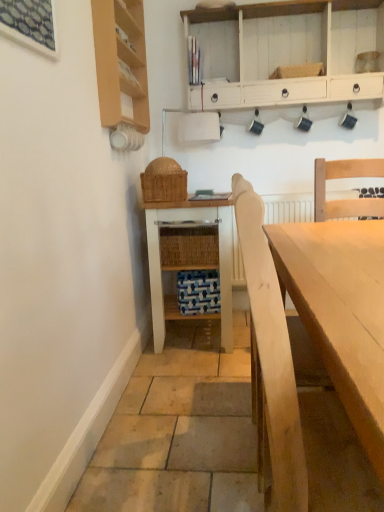
Measure the distance between white wood cabinet at upper center and camera.

A distance of 8.24 feet exists between white wood cabinet at upper center and camera.

You are a GUI agent. You are given a task and a screenshot of the screen. Output one action in this format:
    pyautogui.click(x=<x>, y=<y>)
    Task: Click on the white wood cabinet at upper center
    The image size is (384, 512).
    Given the screenshot: What is the action you would take?
    pyautogui.click(x=285, y=52)

This screenshot has height=512, width=384. What do you see at coordinates (121, 61) in the screenshot? I see `wooden shelf at upper left` at bounding box center [121, 61].

The width and height of the screenshot is (384, 512). Identify the location of woven brown picnic basket at center. (164, 181).

How distant is white wood cabinet at upper center from wooden shelf at upper left?

77.85 centimeters.

From a real-world perspective, who is located higher, white wood cabinet at upper center or wooden shelf at upper left?

white wood cabinet at upper center is physically above.

Does white wood cabinet at upper center have a greater width compared to wooden shelf at upper left?

Yes.

Does white wood cabinet at upper center appear on the left side of wooden shelf at upper left?

Incorrect, white wood cabinet at upper center is not on the left side of wooden shelf at upper left.

From the picture: Is light wood table at center to the left or to the right of white painted wood table at center in the image?

Clearly, light wood table at center is on the right of white painted wood table at center in the image.

From a real-world perspective, between light wood table at center and white painted wood table at center, who is vertically higher?

white painted wood table at center is physically above.

Can you confirm if light wood table at center is taller than white painted wood table at center?

In fact, light wood table at center may be shorter than white painted wood table at center.

What's the angular difference between light wood table at center and white wood cabinet at upper center's facing directions?

The facing directions of light wood table at center and white wood cabinet at upper center are 90.8 degrees apart.

From the image's perspective, is light wood table at center located beneath white wood cabinet at upper center?

Indeed, from the image's perspective, light wood table at center is shown beneath white wood cabinet at upper center.

Could you tell me if light wood table at center is turned towards white wood cabinet at upper center?

No, light wood table at center is not aimed at white wood cabinet at upper center.

Considering the positions of objects light wood table at center and white wood cabinet at upper center in the image provided, who is behind, light wood table at center or white wood cabinet at upper center?

Positioned behind is white wood cabinet at upper center.

Is point (182, 196) closer or farther from the camera than point (289, 281)?

Point (182, 196).

From the image's perspective, is woven brown picnic basket at center located beneath light wood table at center?

No, from the image's perspective, woven brown picnic basket at center is not beneath light wood table at center.

In the scene shown: Is woven brown picnic basket at center shorter than light wood table at center?

Indeed, woven brown picnic basket at center has a lesser height compared to light wood table at center.

Could you tell me if woven brown picnic basket at center is turned towards light wood table at center?

No.

From a real-world perspective, which object rests below the other?

light wood table at center, from a real-world perspective.

Is light wood table at center bigger or smaller than wooden shelf at upper left?

Clearly, light wood table at center is larger in size than wooden shelf at upper left.

From the image's perspective, which one is positioned lower, light wood table at center or wooden shelf at upper left?

From the image's view, light wood table at center is below.

Does white wood cabinet at upper center appear on the right side of woven brown picnic basket at center?

Correct, you'll find white wood cabinet at upper center to the right of woven brown picnic basket at center.

Is white wood cabinet at upper center not close to woven brown picnic basket at center?

No, white wood cabinet at upper center is not far away from woven brown picnic basket at center.

Is white wood cabinet at upper center inside or outside of woven brown picnic basket at center?

white wood cabinet at upper center is not inside woven brown picnic basket at center, it's outside.

Is woven brown picnic basket at center smaller than wooden shelf at upper left?

Indeed, woven brown picnic basket at center has a smaller size compared to wooden shelf at upper left.

Does point (158, 170) lie in front of point (149, 116)?

Yes, point (158, 170) is closer to viewer.

Based on the photo, which of these two, woven brown picnic basket at center or wooden shelf at upper left, stands taller?

wooden shelf at upper left.

Considering the relative sizes of woven brown picnic basket at center and wooden shelf at upper left in the image provided, is woven brown picnic basket at center wider than wooden shelf at upper left?

Yes, woven brown picnic basket at center is wider than wooden shelf at upper left.

Identify the location of shelf in front of the white wood cabinet at upper center. This screenshot has width=384, height=512. (121, 61).

This screenshot has height=512, width=384. I want to click on table located behind the light wood table at center, so click(189, 256).

When comparing their distances from wooden shelf at upper left, does white painted wood table at center or white wood cabinet at upper center seem further?

white painted wood table at center is positioned further to the anchor wooden shelf at upper left.

Which object lies nearer to the anchor point light wood table at center, white painted wood table at center or wooden shelf at upper left?

The object closer to light wood table at center is white painted wood table at center.

Based on their spatial positions, is white wood cabinet at upper center or white painted wood table at center closer to light wood table at center?

white painted wood table at center.

Based on their spatial positions, is wooden shelf at upper left or light wood table at center closer to white wood cabinet at upper center?

The object closer to white wood cabinet at upper center is wooden shelf at upper left.

When comparing their distances from white wood cabinet at upper center, does white painted wood table at center or woven brown picnic basket at center seem further?

white painted wood table at center.

Estimate the real-world distances between objects in this image. Which object is closer to white painted wood table at center, woven brown picnic basket at center or wooden shelf at upper left?

The object closer to white painted wood table at center is woven brown picnic basket at center.

Considering their positions, is wooden shelf at upper left positioned closer to light wood table at center than white wood cabinet at upper center?

wooden shelf at upper left is closer to light wood table at center.

When comparing their distances from wooden shelf at upper left, does light wood table at center or white painted wood table at center seem further?

light wood table at center lies further to wooden shelf at upper left than the other object.

Identify the location of picnic basket between wooden shelf at upper left and white painted wood table at center from top to bottom. Image resolution: width=384 pixels, height=512 pixels. (164, 181).

The height and width of the screenshot is (512, 384). Find the location of `picnic basket between wooden shelf at upper left and white wood cabinet at upper center from left to right`. picnic basket between wooden shelf at upper left and white wood cabinet at upper center from left to right is located at coordinates (164, 181).

Identify the location of shelf between light wood table at center and woven brown picnic basket at center from front to back. (121, 61).

Where is `shelf between light wood table at center and white wood cabinet at upper center from front to back`? The height and width of the screenshot is (512, 384). shelf between light wood table at center and white wood cabinet at upper center from front to back is located at coordinates (121, 61).